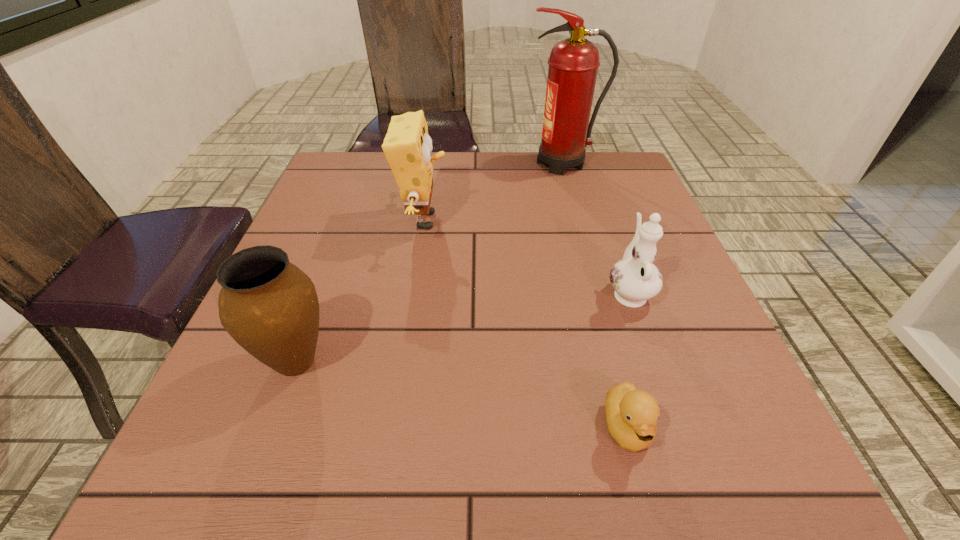
I want to click on free area in between the third nearest object and the fourth nearest object, so click(526, 256).

Image resolution: width=960 pixels, height=540 pixels. I want to click on vacant region between the sponge and the chinaware, so click(526, 256).

Locate an element on the screen. free space between the nearest object and the leftmost object is located at coordinates (462, 395).

Where is `unoccupied area between the nearest object and the second farthest object`? The height and width of the screenshot is (540, 960). unoccupied area between the nearest object and the second farthest object is located at coordinates (525, 324).

Identify the location of empty space between the chinaware and the leftmost object. The image size is (960, 540). (462, 326).

I want to click on vacant space that is in between the sponge and the tallest object, so click(493, 192).

Find the location of a particular element. This screenshot has height=540, width=960. free space between the duckling and the chinaware is located at coordinates 628,360.

You are a GUI agent. You are given a task and a screenshot of the screen. Output one action in this format:
    pyautogui.click(x=<x>, y=<y>)
    Task: Click on the unoccupied position between the farthest object and the sponge
    This screenshot has width=960, height=540.
    Given the screenshot: What is the action you would take?
    pyautogui.click(x=493, y=192)

Identify the location of empty space that is in between the fire extinguisher and the fourth object from right to left. (493, 192).

The image size is (960, 540). Find the location of `free space between the fire extinguisher and the sponge`. free space between the fire extinguisher and the sponge is located at coordinates (493, 192).